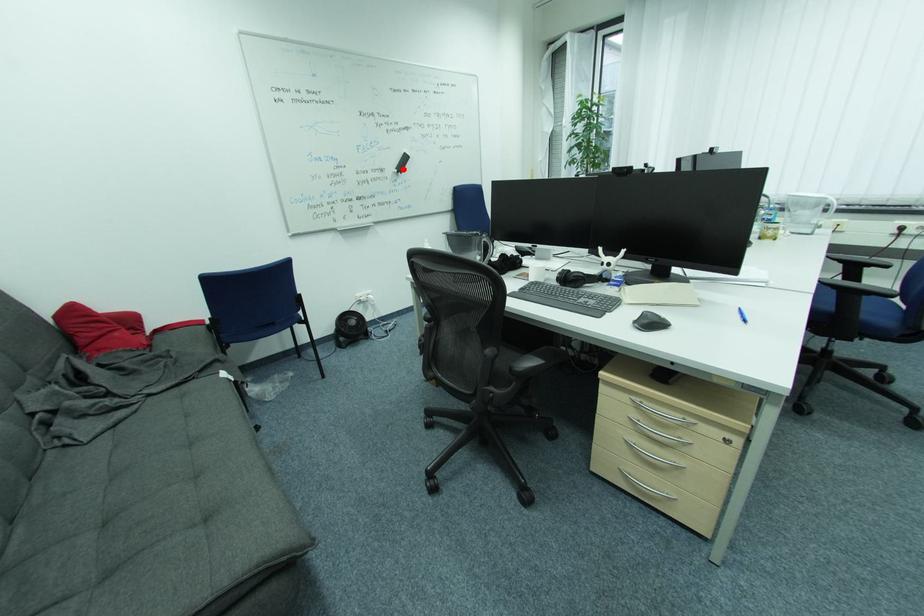
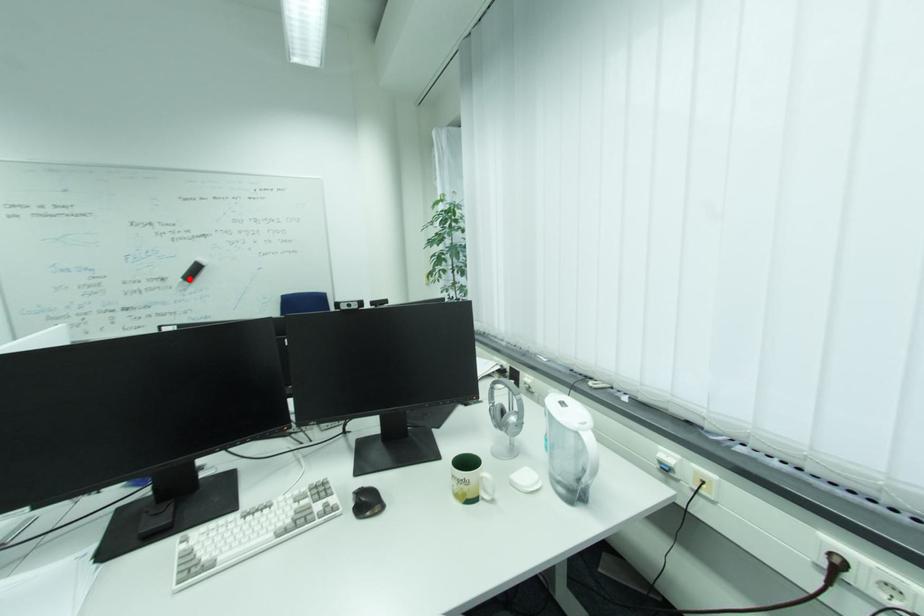
I am providing you with two images of the same scene from different viewpoints. A red point is marked on the first image and another point is marked on the second image. Do the highlighted points in image1 and image2 indicate the same real-world spot?

Yes